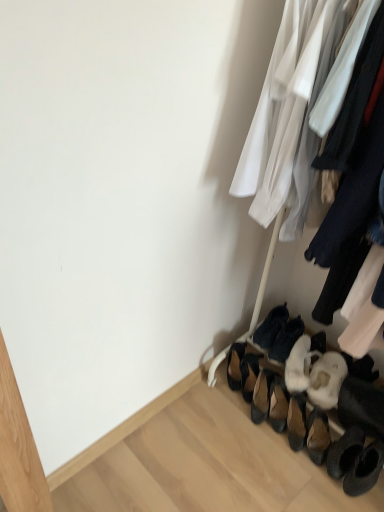
Question: Does black suede heels at lower right, the 4th footwear in the right-to-left sequence, have a smaller size compared to leather/textured shoe at lower center, which is the 3th footwear from right to left?

Choices:
 (A) yes
 (B) no

Answer: (B)

Question: From the image's perspective, is black suede heels at lower right, the 4th footwear in the right-to-left sequence, under leather/textured shoe at lower center, which is the 3th footwear from right to left?

Choices:
 (A) no
 (B) yes

Answer: (A)

Question: Is black suede heels at lower right, the first footwear when ordered from left to right, looking in the opposite direction of leather/textured shoe at lower center, placed as the second footwear when sorted from left to right?

Choices:
 (A) yes
 (B) no

Answer: (B)

Question: Is black suede heels at lower right, the 4th footwear in the right-to-left sequence, shorter than leather/textured shoe at lower center, which is the 3th footwear from right to left?

Choices:
 (A) yes
 (B) no

Answer: (B)

Question: Considering the relative positions of black suede heels at lower right, the 4th footwear in the right-to-left sequence, and leather/textured shoe at lower center, which is the 3th footwear from right to left, in the image provided, is black suede heels at lower right, the 4th footwear in the right-to-left sequence, to the left of leather/textured shoe at lower center, which is the 3th footwear from right to left, from the viewer's perspective?

Choices:
 (A) yes
 (B) no

Answer: (A)

Question: Is black suede heels at lower right, the 4th footwear in the right-to-left sequence, with leather/textured shoe at lower center, which is the 3th footwear from right to left?

Choices:
 (A) no
 (B) yes

Answer: (B)

Question: From the image's perspective, is dark blue suede shoes at lower right, the 1th footwear in the right-to-left sequence, over leather/textured shoe at lower center, which is the 3th footwear from right to left?

Choices:
 (A) yes
 (B) no

Answer: (A)

Question: Is dark blue suede shoes at lower right, the 1th footwear in the right-to-left sequence, facing towards leather/textured shoe at lower center, which is the 3th footwear from right to left?

Choices:
 (A) no
 (B) yes

Answer: (A)

Question: Does dark blue suede shoes at lower right, the 1th footwear in the right-to-left sequence, lie in front of leather/textured shoe at lower center, which is the 3th footwear from right to left?

Choices:
 (A) yes
 (B) no

Answer: (B)

Question: From a real-world perspective, is dark blue suede shoes at lower right, the 1th footwear in the right-to-left sequence, located beneath leather/textured shoe at lower center, which is the 3th footwear from right to left?

Choices:
 (A) no
 (B) yes

Answer: (A)

Question: Can you confirm if dark blue suede shoes at lower right, the fourth footwear from the left, is thinner than leather/textured shoe at lower center, placed as the second footwear when sorted from left to right?

Choices:
 (A) no
 (B) yes

Answer: (A)

Question: From a real-world perspective, is dark blue suede shoes at lower right, the fourth footwear from the left, positioned over leather/textured shoe at lower center, which is the 3th footwear from right to left, based on gravity?

Choices:
 (A) no
 (B) yes

Answer: (B)

Question: Is black suede heels at lower right, the first footwear when ordered from left to right, surrounded by leather/textured shoe at lower center, which is the 3th footwear from right to left?

Choices:
 (A) no
 (B) yes

Answer: (A)